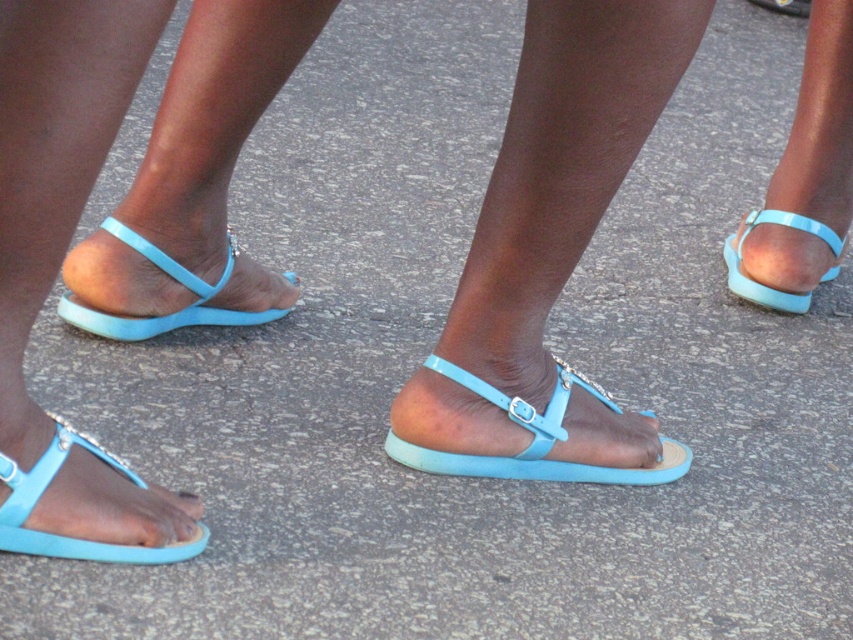
You are standing in a casual outdoor setting and see a point at coordinates (534, 438). Which object from the scene does this point lie on?

The point at coordinates (534, 438) is on the matte blue sandal at center.

What are the coordinates of the matte blue sandal at center?

The matte blue sandal at center is located at point (534, 438).